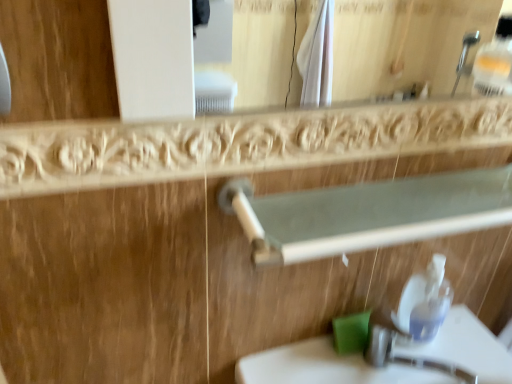
Where is `vacant space underneath white plastic rail at upper center (from a real-world perspective)`? This screenshot has height=384, width=512. vacant space underneath white plastic rail at upper center (from a real-world perspective) is located at coordinates (362, 362).